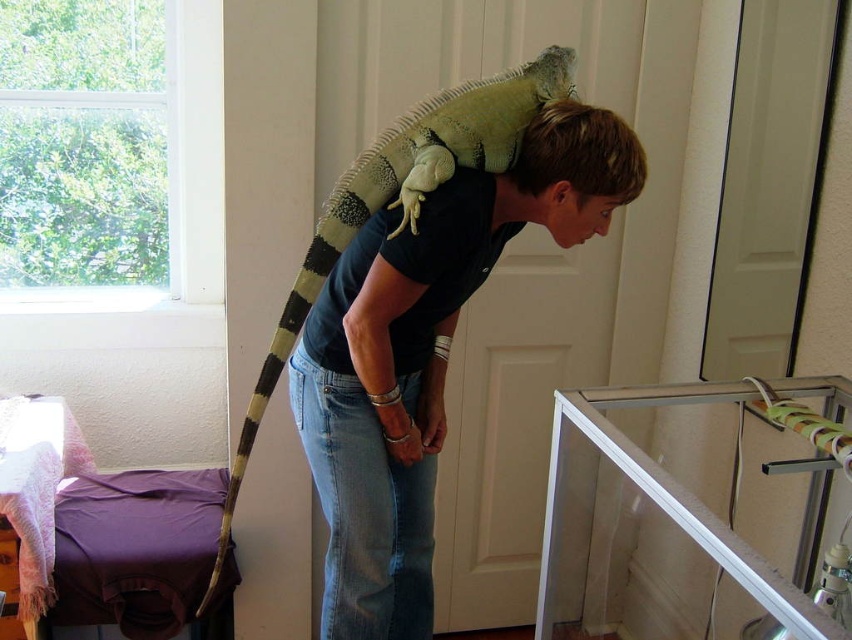
You are a photographer trying to capture a closeup of the short blonde hair at upper center without including the matte black shirt at upper center in the frame. Based on their positions, is this possible?

The matte black shirt at upper center is to the left of short blonde hair at upper center, so if you position your camera to the right side of the short blonde hair at upper center, you can exclude the matte black shirt at upper center from the frame.